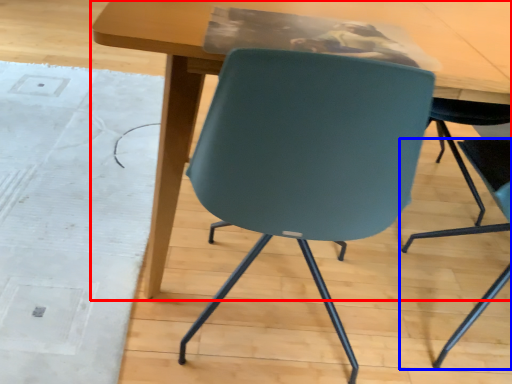
Question: Which object is further to the camera taking this photo, table (highlighted by a red box) or chair (highlighted by a blue box)?

Choices:
 (A) table
 (B) chair

Answer: (A)